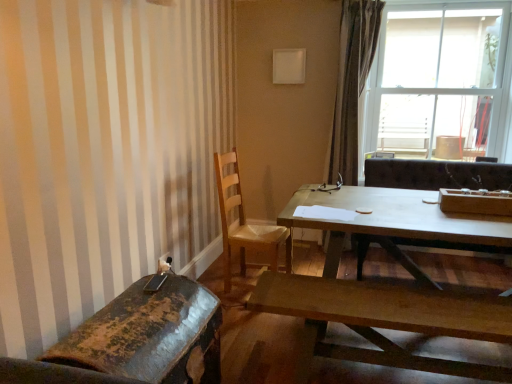
Question: Considering the positions of point (380, 215) and point (257, 244), is point (380, 215) closer or farther from the camera than point (257, 244)?

Choices:
 (A) closer
 (B) farther

Answer: (A)

Question: Is light brown wooden table at center, which is the first coffee table from back to front, taller or shorter than wooden chair at center, arranged as the 1th chair when viewed from the back?

Choices:
 (A) short
 (B) tall

Answer: (A)

Question: Which of these objects is positioned closest to the transparent glass window at upper right?

Choices:
 (A) brown textured curtain at upper right
 (B) wooden chair at center, the 2th chair viewed from the front
 (C) light brown wooden table at center, which is the first coffee table from back to front
 (D) rusty metal chair at lower left, which is counted as the 1th chair, starting from the front
 (E) wooden bench at lower center, which appears as the first coffee table when viewed from the front

Answer: (A)

Question: Which object is the farthest from the transparent glass window at upper right?

Choices:
 (A) wooden chair at center, arranged as the 1th chair when viewed from the back
 (B) wooden bench at lower center, the 2th coffee table viewed from the back
 (C) light brown wooden table at center, which is the first coffee table from back to front
 (D) rusty metal chair at lower left, the 2th chair positioned from the back
 (E) brown textured curtain at upper right

Answer: (D)